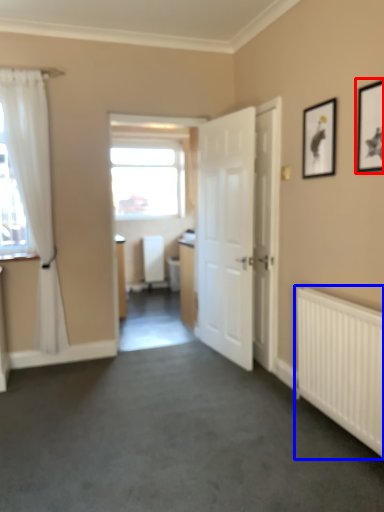
Question: Which object appears farthest to the camera in this image, picture frame (highlighted by a red box) or radiator (highlighted by a blue box)?

Choices:
 (A) picture frame
 (B) radiator

Answer: (B)